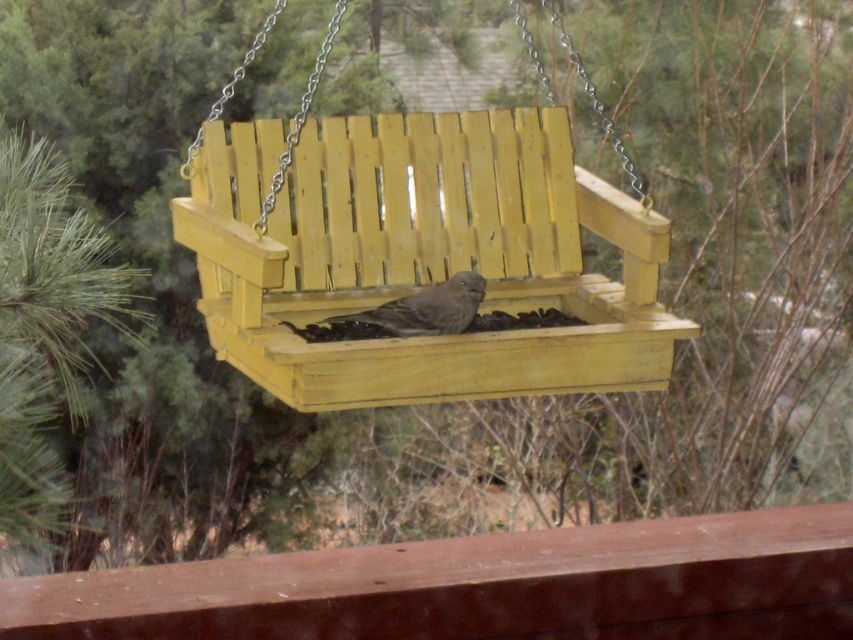
Is yellow wood swing at center thinner than brown matte bird at center?

No.

Is yellow wood swing at center to the left of brown matte bird at center from the viewer's perspective?

Incorrect, yellow wood swing at center is not on the left side of brown matte bird at center.

Find the location of a particular element. The width and height of the screenshot is (853, 640). yellow wood swing at center is located at coordinates (416, 252).

Where is `yellow wood swing at center`? yellow wood swing at center is located at coordinates pyautogui.click(x=416, y=252).